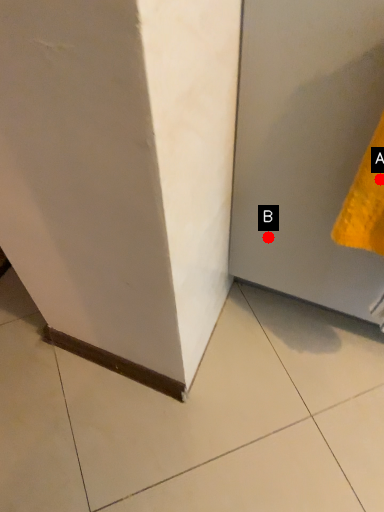
Question: Two points are circled on the image, labeled by A and B beside each circle. Among these points, which one is nearest to the camera?

Choices:
 (A) A is closer
 (B) B is closer

Answer: (A)